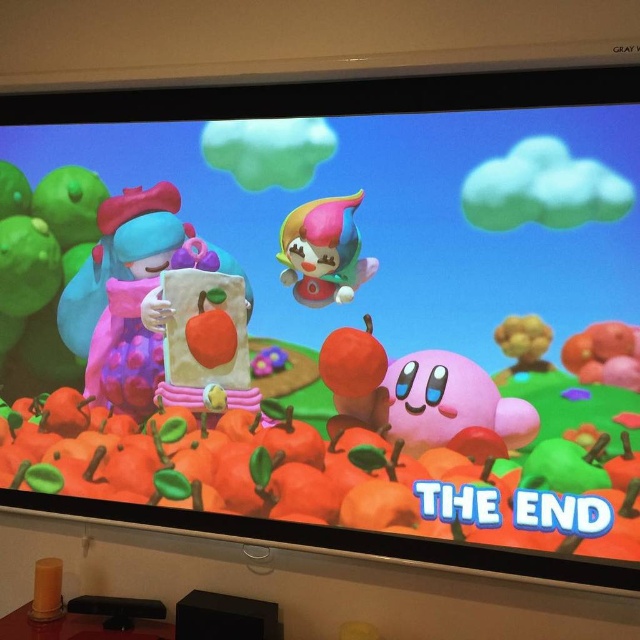
Who is taller, pastel plastic toy at center or smooth orange fruit at right?

pastel plastic toy at center is taller.

This screenshot has width=640, height=640. I want to click on pastel plastic toy at center, so click(x=323, y=252).

Based on the photo, is matte pink plush at left to the left of pastel plastic toy at center from the viewer's perspective?

Yes, matte pink plush at left is to the left of pastel plastic toy at center.

Can you confirm if matte pink plush at left is wider than pastel plastic toy at center?

Correct, the width of matte pink plush at left exceeds that of pastel plastic toy at center.

Measure the distance between matte pink plush at left and camera.

They are 5.38 feet apart.

Locate an element on the screen. matte pink plush at left is located at coordinates (122, 298).

Can you confirm if smooth orange fruit at right is positioned above wooden toy at right?

No, smooth orange fruit at right is not above wooden toy at right.

Between smooth orange fruit at right and wooden toy at right, which one has more height?

Standing taller between the two is wooden toy at right.

I want to click on smooth orange fruit at right, so click(604, 355).